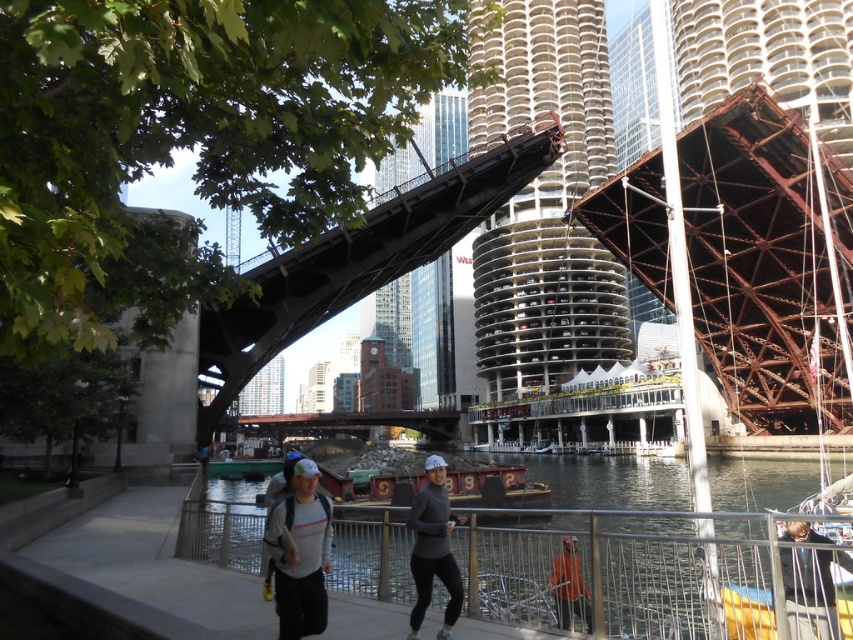
Is matte black leggings at center to the right of dark gray fabric jacket at lower right from the viewer's perspective?

Incorrect, matte black leggings at center is not on the right side of dark gray fabric jacket at lower right.

Is matte black leggings at center to the left of dark gray fabric jacket at lower right from the viewer's perspective?

Correct, you'll find matte black leggings at center to the left of dark gray fabric jacket at lower right.

Is point (410, 611) positioned after point (798, 618)?

That is True.

At what (x,y) coordinates should I click in order to perform the action: click on matte black leggings at center. Please return your answer as a coordinate pair (x, y). The height and width of the screenshot is (640, 853). Looking at the image, I should click on (433, 548).

Is matte gray hoodie at center wider than dark gray fabric jacket at lower right?

Yes.

Does matte gray hoodie at center have a lesser width compared to dark gray fabric jacket at lower right?

No.

Is point (316, 612) positioned in front of point (828, 580)?

That is False.

You are a GUI agent. You are given a task and a screenshot of the screen. Output one action in this format:
    pyautogui.click(x=<x>, y=<y>)
    Task: Click on the matte gray hoodie at center
    This screenshot has height=640, width=853.
    Given the screenshot: What is the action you would take?
    pyautogui.click(x=300, y=552)

Does black steel bridge at center have a greater height compared to matte black leggings at center?

Yes, black steel bridge at center is taller than matte black leggings at center.

Which is above, black steel bridge at center or matte black leggings at center?

Positioned higher is black steel bridge at center.

Image resolution: width=853 pixels, height=640 pixels. What do you see at coordinates (361, 259) in the screenshot?
I see `black steel bridge at center` at bounding box center [361, 259].

Where is `black steel bridge at center`? The width and height of the screenshot is (853, 640). black steel bridge at center is located at coordinates (361, 259).